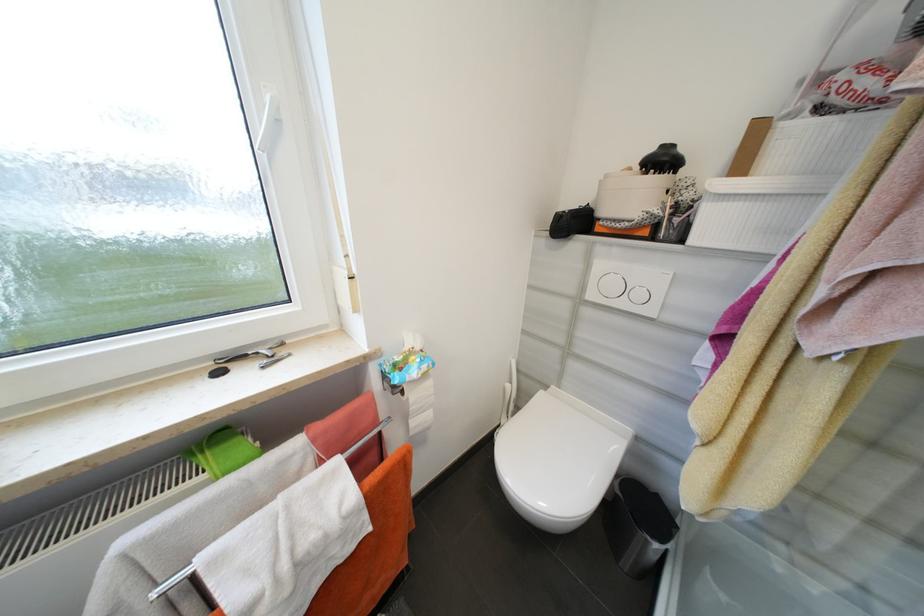
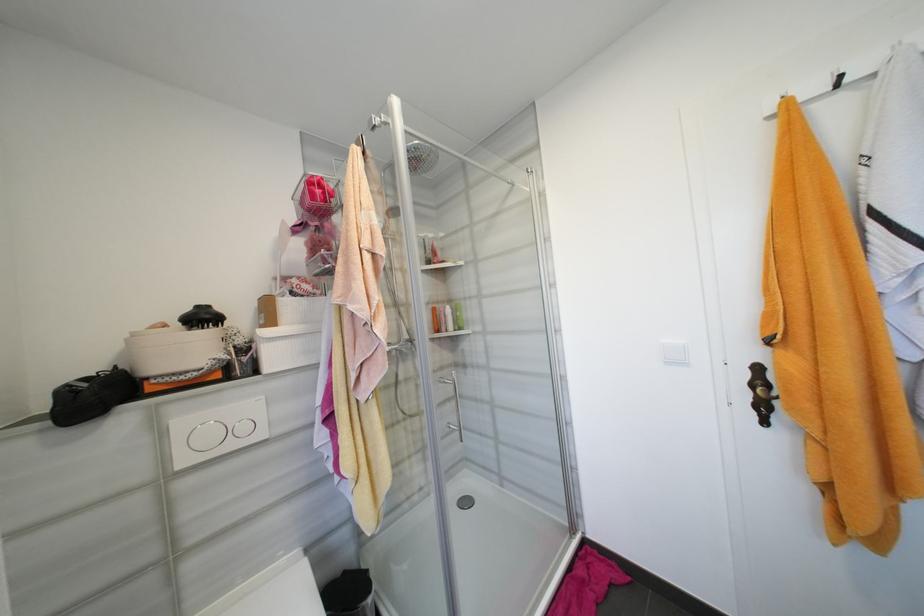
The point at (612, 177) is marked in the first image. Where is the corresponding point in the second image?

(140, 334)